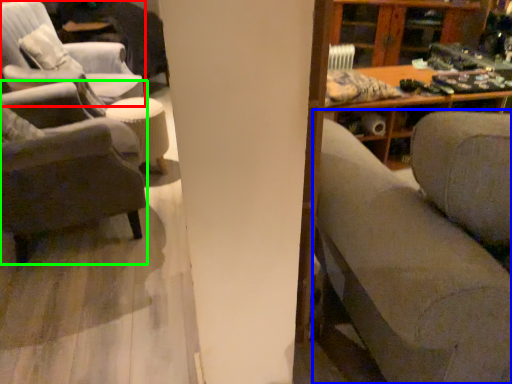
Question: Which object is positioned closest to chair (highlighted by a red box)? Select from studio couch (highlighted by a blue box) and chair (highlighted by a green box).

Choices:
 (A) studio couch
 (B) chair

Answer: (B)